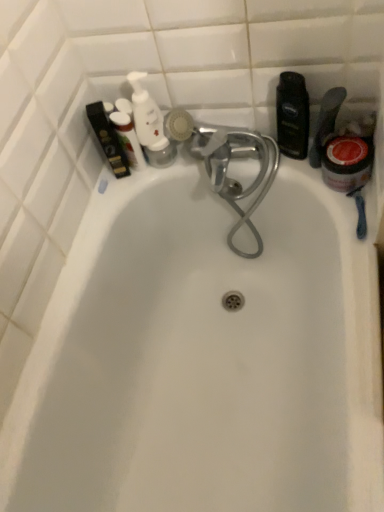
Question: Could you tell me if matte black box at upper left, which is the fifth toiletry in right-to-left order, is turned towards white glossy pump bottle at upper left, which is the second toiletry in left-to-right order?

Choices:
 (A) yes
 (B) no

Answer: (B)

Question: Can you confirm if matte black box at upper left, which is the fifth toiletry in right-to-left order, is positioned to the left of white glossy pump bottle at upper left, the 4th toiletry positioned from the right?

Choices:
 (A) no
 (B) yes

Answer: (B)

Question: From the image's perspective, is matte black box at upper left, positioned as the 1th toiletry in left-to-right order, above white glossy pump bottle at upper left, which is the second toiletry in left-to-right order?

Choices:
 (A) yes
 (B) no

Answer: (B)

Question: Is matte black box at upper left, positioned as the 1th toiletry in left-to-right order, outside of white glossy pump bottle at upper left, which is the second toiletry in left-to-right order?

Choices:
 (A) yes
 (B) no

Answer: (A)

Question: Is matte black box at upper left, positioned as the 1th toiletry in left-to-right order, oriented away from white glossy pump bottle at upper left, the 4th toiletry positioned from the right?

Choices:
 (A) yes
 (B) no

Answer: (B)

Question: From a real-world perspective, is matte black box at upper left, positioned as the 1th toiletry in left-to-right order, below white glossy pump bottle at upper left, which is the second toiletry in left-to-right order?

Choices:
 (A) yes
 (B) no

Answer: (A)

Question: Can you confirm if white plastic pump bottle at upper left, positioned as the 3th toiletry in right-to-left order, is shorter than red glossy jar at right?

Choices:
 (A) yes
 (B) no

Answer: (B)

Question: Is white plastic pump bottle at upper left, positioned as the 3th toiletry in right-to-left order, with red glossy jar at right?

Choices:
 (A) no
 (B) yes

Answer: (A)

Question: Is white plastic pump bottle at upper left, positioned as the 3th toiletry in right-to-left order, looking in the opposite direction of red glossy jar at right?

Choices:
 (A) yes
 (B) no

Answer: (B)

Question: Can you confirm if white plastic pump bottle at upper left, arranged as the third toiletry when viewed from the left, is thinner than red glossy jar at right?

Choices:
 (A) no
 (B) yes

Answer: (B)

Question: From the image's perspective, does white plastic pump bottle at upper left, arranged as the third toiletry when viewed from the left, appear higher than red glossy jar at right?

Choices:
 (A) yes
 (B) no

Answer: (A)

Question: Does white plastic pump bottle at upper left, arranged as the third toiletry when viewed from the left, appear on the left side of red glossy jar at right?

Choices:
 (A) no
 (B) yes

Answer: (B)

Question: Is white glossy pump bottle at upper left, the 4th toiletry positioned from the right, positioned far away from white plastic pump bottle at upper left, positioned as the 3th toiletry in right-to-left order?

Choices:
 (A) no
 (B) yes

Answer: (A)